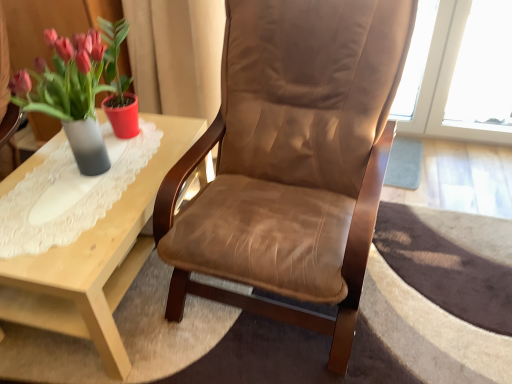
Question: Could brown leather chair at center be considered to be inside matte gray vase at left?

Choices:
 (A) no
 (B) yes

Answer: (A)

Question: Is matte gray vase at left positioned behind brown leather chair at center?

Choices:
 (A) yes
 (B) no

Answer: (A)

Question: Considering the relative sizes of matte gray vase at left and brown leather chair at center in the image provided, is matte gray vase at left wider than brown leather chair at center?

Choices:
 (A) no
 (B) yes

Answer: (A)

Question: From the image's perspective, is matte gray vase at left under brown leather chair at center?

Choices:
 (A) no
 (B) yes

Answer: (A)

Question: Considering the relative sizes of matte gray vase at left and brown leather chair at center in the image provided, is matte gray vase at left shorter than brown leather chair at center?

Choices:
 (A) no
 (B) yes

Answer: (B)

Question: From the image's perspective, is brown leather chair at center above or below matte gray vase at left?

Choices:
 (A) below
 (B) above

Answer: (A)

Question: In terms of height, does brown leather chair at center look taller or shorter compared to matte gray vase at left?

Choices:
 (A) tall
 (B) short

Answer: (A)

Question: From a real-world perspective, is brown leather chair at center physically located above or below matte gray vase at left?

Choices:
 (A) above
 (B) below

Answer: (B)

Question: Is brown leather chair at center situated inside matte gray vase at left or outside?

Choices:
 (A) outside
 (B) inside

Answer: (A)

Question: Considering the relative positions of light wood coffee table at left and brown leather chair at center in the image provided, is light wood coffee table at left to the left or to the right of brown leather chair at center?

Choices:
 (A) left
 (B) right

Answer: (A)

Question: From the image's perspective, relative to brown leather chair at center, is light wood coffee table at left above or below?

Choices:
 (A) below
 (B) above

Answer: (A)

Question: Relative to brown leather chair at center, is light wood coffee table at left in front or behind?

Choices:
 (A) behind
 (B) front

Answer: (A)

Question: Is point (99, 314) positioned closer to the camera than point (362, 208)?

Choices:
 (A) farther
 (B) closer

Answer: (A)

Question: Relative to light wood coffee table at left, is brown leather chair at center in front or behind?

Choices:
 (A) behind
 (B) front

Answer: (B)

Question: Is point (269, 109) positioned closer to the camera than point (139, 175)?

Choices:
 (A) closer
 (B) farther

Answer: (B)